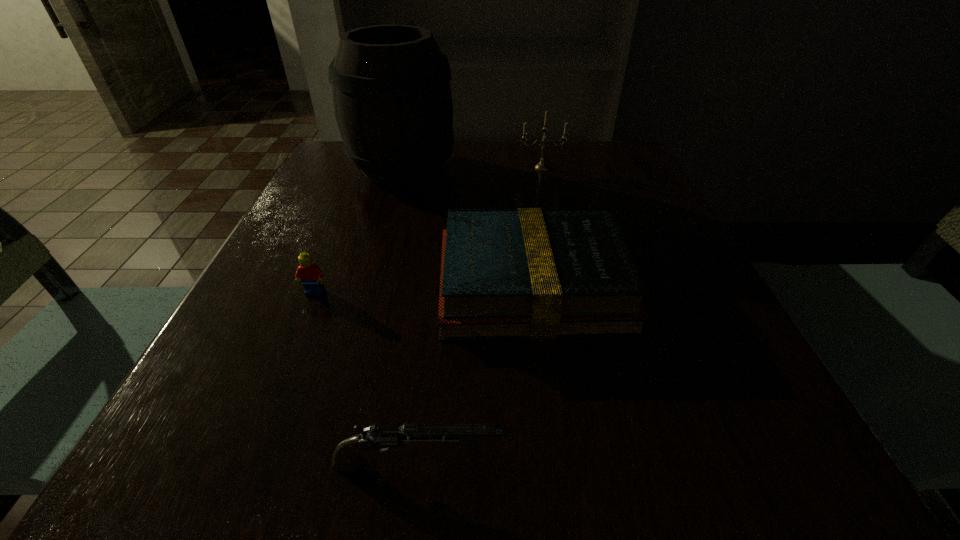
I want to click on free location that satisfies the following two spatial constraints: 1. on the front side of the hardback book; 2. on the right side of the tallest object, so click(x=372, y=285).